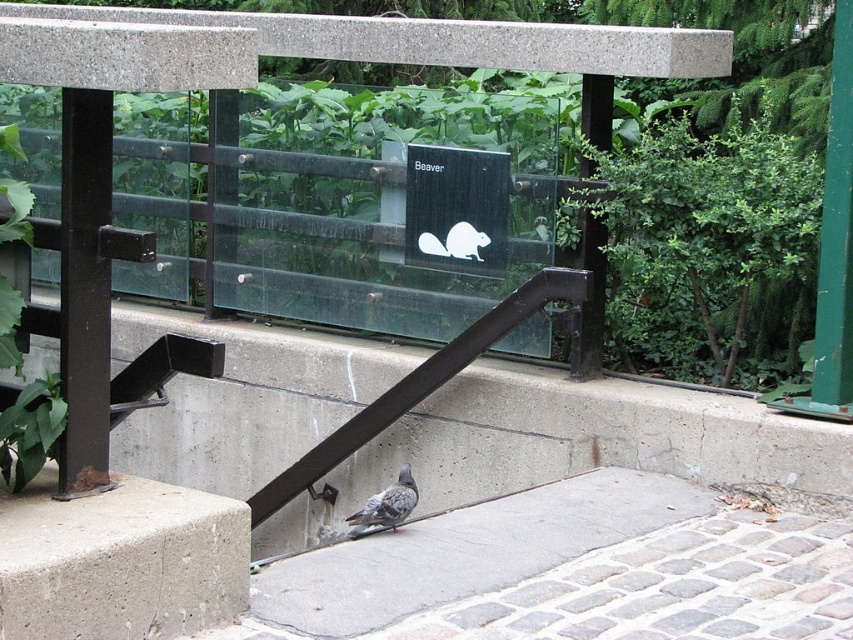
Does gray concrete sidewalk at center have a lesser height compared to gray speckled pigeon at lower center?

No, gray concrete sidewalk at center is not shorter than gray speckled pigeon at lower center.

Does gray concrete sidewalk at center have a larger size compared to gray speckled pigeon at lower center?

Indeed, gray concrete sidewalk at center has a larger size compared to gray speckled pigeon at lower center.

The height and width of the screenshot is (640, 853). Describe the element at coordinates (466, 552) in the screenshot. I see `gray concrete sidewalk at center` at that location.

The height and width of the screenshot is (640, 853). I want to click on gray concrete sidewalk at center, so click(x=466, y=552).

Is gray concrete sidewalk at center wider than white matte beaver at center?

Yes.

Does gray concrete sidewalk at center have a lesser width compared to white matte beaver at center?

No.

Is point (395, 582) positioned after point (480, 259)?

No, (395, 582) is closer to viewer.

Identify the location of gray concrete sidewalk at center. The width and height of the screenshot is (853, 640). (466, 552).

Is gray concrete block at lower left shorter than gray speckled pigeon at lower center?

No, gray concrete block at lower left is not shorter than gray speckled pigeon at lower center.

This screenshot has width=853, height=640. In order to click on gray concrete block at lower left in this screenshot , I will do `click(119, 561)`.

Does point (163, 632) lie behind point (415, 502)?

No.

Where is `gray concrete block at lower left`? gray concrete block at lower left is located at coordinates [x=119, y=561].